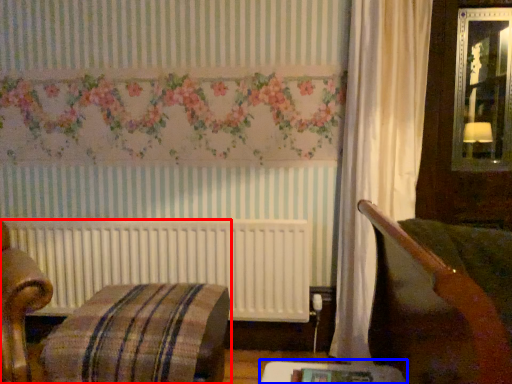
Question: Which object appears closest to the camera in this image, furniture (highlighted by a red box) or table (highlighted by a blue box)?

Choices:
 (A) furniture
 (B) table

Answer: (B)